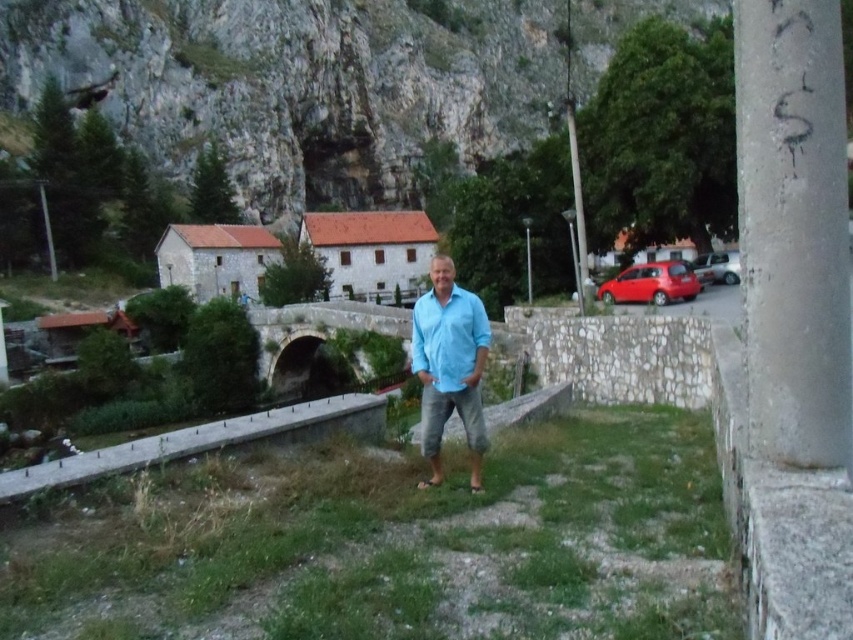
In the scene shown: Where is the blue cotton shirt at center located in the image?

The blue cotton shirt at center is located at the 2D coordinates point (450,365) in the image.

You are standing at the point with coordinates point at (x=566, y=92) and want to walk towards the stone bridge in the scene. Which direction should you move relative to the point at (x=811, y=451)?

You should move towards the point at (x=811, y=451) because it is closer to the camera and likely in the direction of the stone bridge.